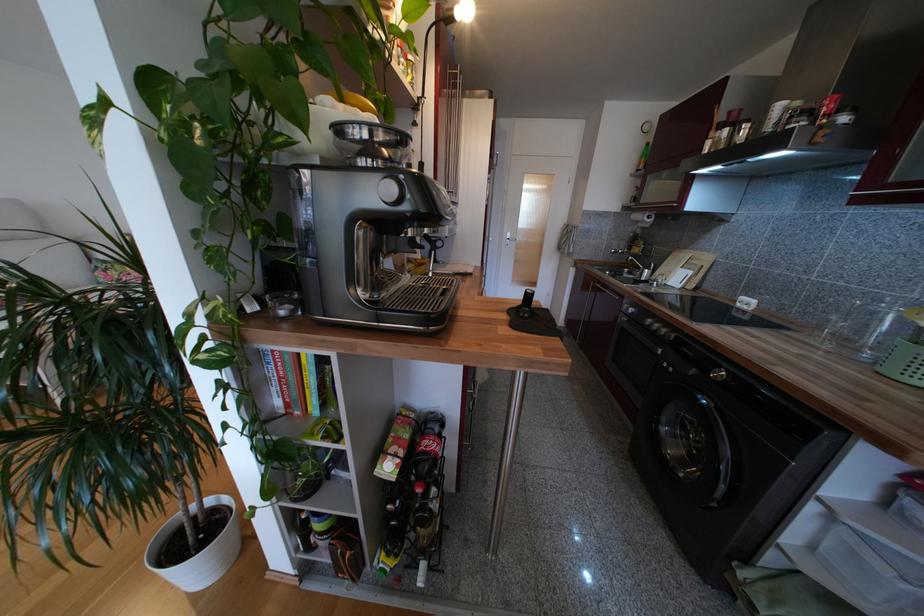
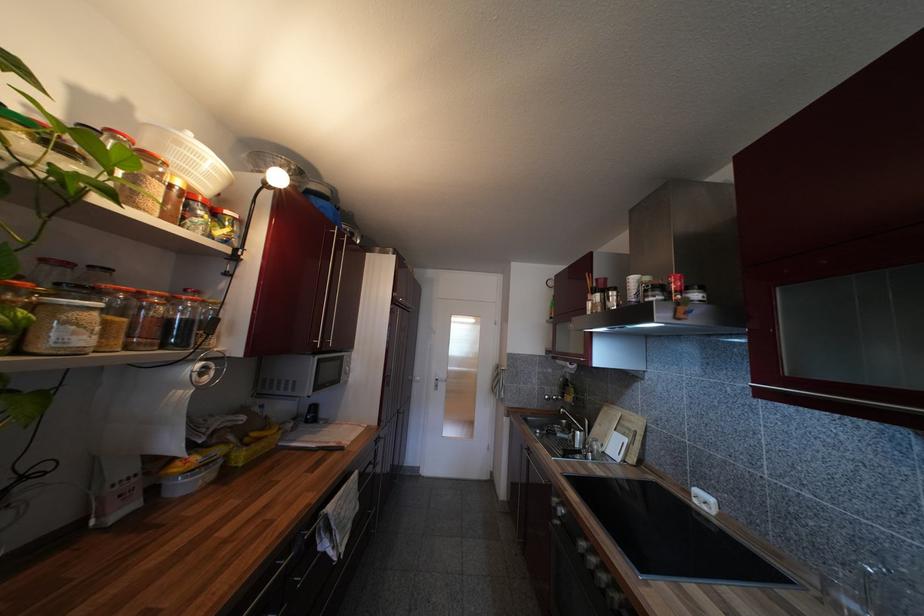
Question: The images are taken continuously from a first-person perspective. In which direction is your viewpoint rotating?

Choices:
 (A) Left
 (B) Right
 (C) Up
 (D) Down

Answer: (C)